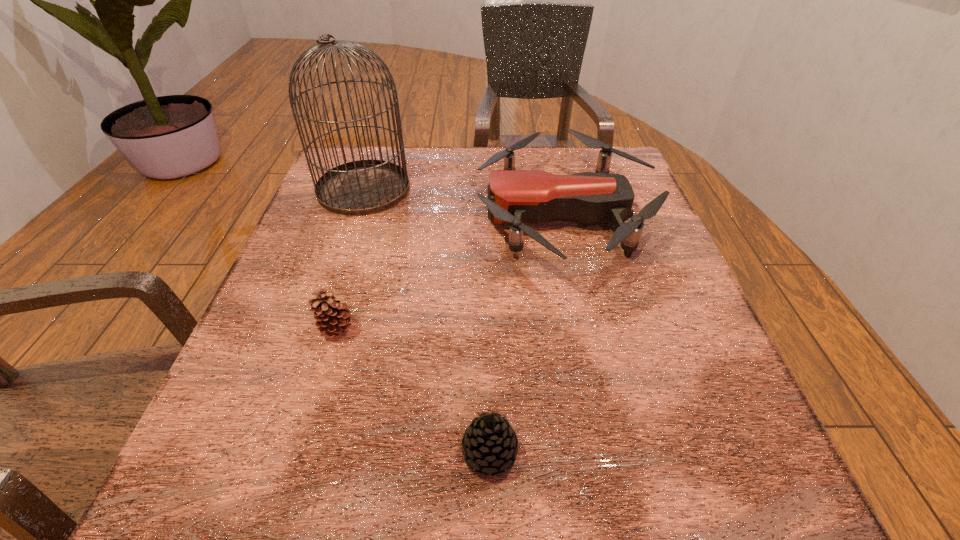
I want to click on vacant space located 0.320m on the back of the farther pinecone, so click(x=373, y=205).

Where is `free space located 0.160m at the narrow end of the nearer pinecone`? This screenshot has width=960, height=540. free space located 0.160m at the narrow end of the nearer pinecone is located at coordinates (341, 452).

Identify the location of free point located at the narrow end of the nearer pinecone. The image size is (960, 540). (279, 452).

This screenshot has height=540, width=960. Identify the location of free space located at the narrow end of the nearer pinecone. [x=227, y=452].

The width and height of the screenshot is (960, 540). What are the coordinates of `birdcage located in the far edge section of the desktop` in the screenshot? It's located at (363, 187).

Locate an element on the screen. The width and height of the screenshot is (960, 540). drone positioned at the far edge is located at coordinates (517, 197).

In order to click on object at the near edge in this screenshot , I will do point(489,444).

The image size is (960, 540). What are the coordinates of `birdcage located at the left edge` in the screenshot? It's located at (363, 187).

Image resolution: width=960 pixels, height=540 pixels. What are the coordinates of `pinecone located in the left edge section of the desktop` in the screenshot? It's located at (332, 317).

Identify the location of object that is at the right edge. The width and height of the screenshot is (960, 540). (517, 197).